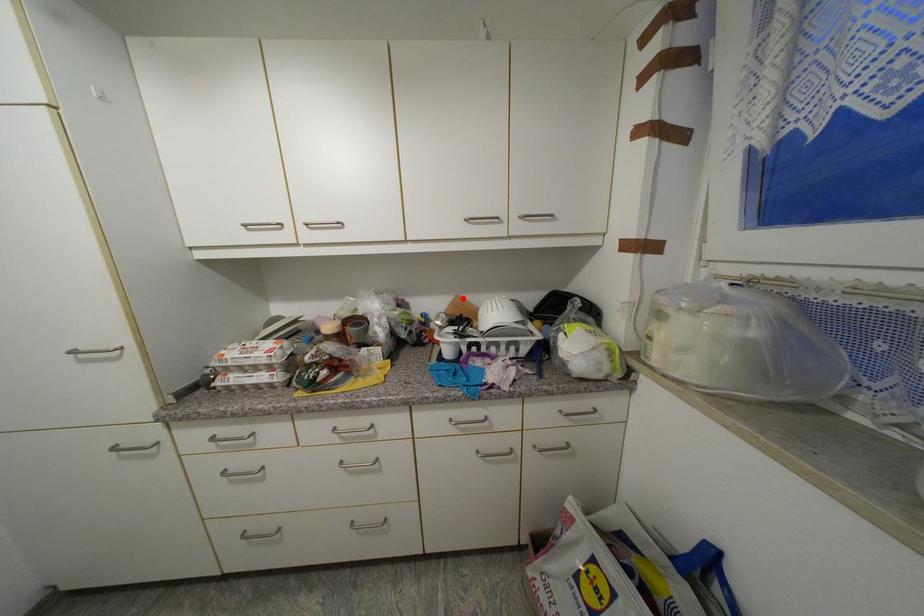
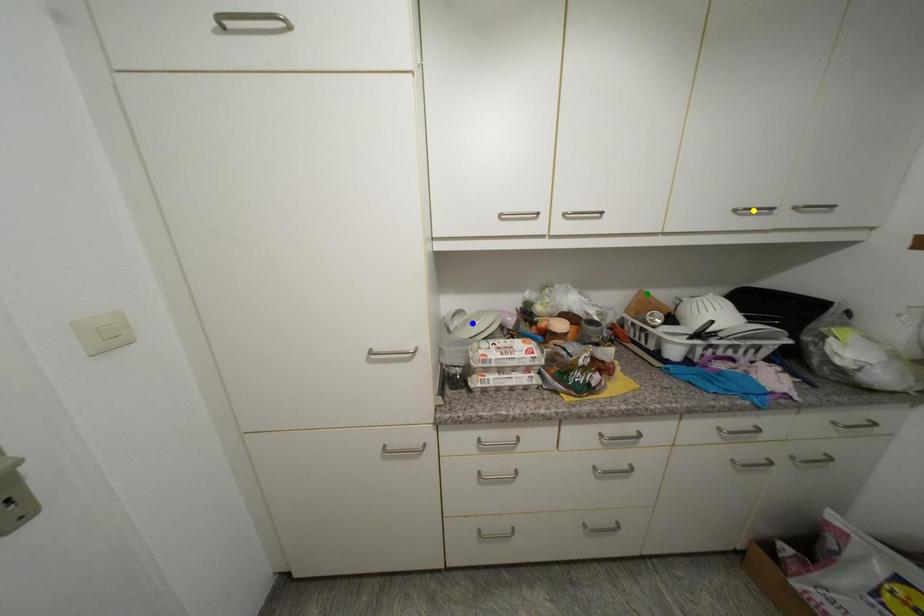
Question: I am providing you with two images of the same scene from different viewpoints. A red point is marked on the first image. You are given multiple points on the second image. Which spot in image 2 lines up with the point in image 1?

Choices:
 (A) blue point
 (B) yellow point
 (C) green point

Answer: (C)